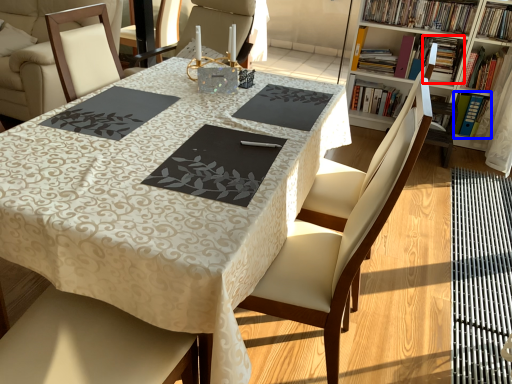
Question: Which point is closer to the camera, book (highlighted by a red box) or book (highlighted by a blue box)?

Choices:
 (A) book
 (B) book

Answer: (B)